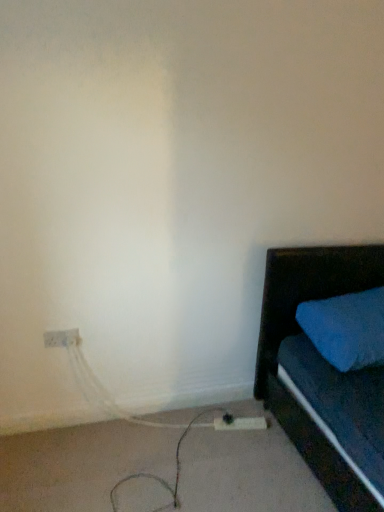
The width and height of the screenshot is (384, 512). Find the location of `vacant space behind white plastic extension cord at lower center`. vacant space behind white plastic extension cord at lower center is located at coordinates (232, 406).